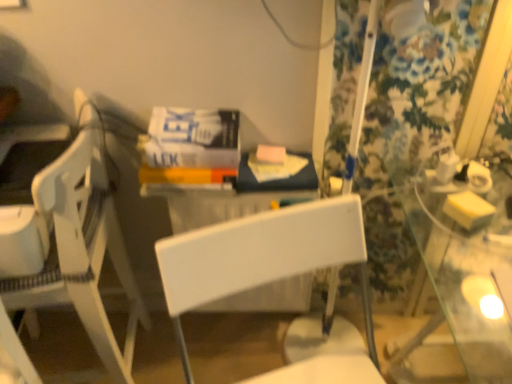
Question: From the image's perspective, is floral fabric curtain at right under white plastic chair at left, the 1th chair from the left?

Choices:
 (A) no
 (B) yes

Answer: (A)

Question: Is floral fabric curtain at right oriented away from white plastic chair at left, the 1th chair from the left?

Choices:
 (A) no
 (B) yes

Answer: (A)

Question: Does floral fabric curtain at right have a larger size compared to white plastic chair at left, the 1th chair from the left?

Choices:
 (A) yes
 (B) no

Answer: (B)

Question: Can you confirm if floral fabric curtain at right is wider than white plastic chair at left, which is the second chair in right-to-left order?

Choices:
 (A) no
 (B) yes

Answer: (A)

Question: Could you tell me if floral fabric curtain at right is facing white plastic chair at left, the 1th chair from the left?

Choices:
 (A) yes
 (B) no

Answer: (B)

Question: Is point (309, 228) closer or farther from the camera than point (439, 91)?

Choices:
 (A) closer
 (B) farther

Answer: (A)

Question: In the image, is white plastic chair at center, placed as the 1th chair when sorted from right to left, positioned in front of or behind floral fabric curtain at right?

Choices:
 (A) front
 (B) behind

Answer: (A)

Question: Considering the positions of white plastic chair at center, the 2th chair viewed from the left, and floral fabric curtain at right in the image, is white plastic chair at center, the 2th chair viewed from the left, bigger or smaller than floral fabric curtain at right?

Choices:
 (A) big
 (B) small

Answer: (A)

Question: In terms of width, does white plastic chair at center, placed as the 1th chair when sorted from right to left, look wider or thinner when compared to floral fabric curtain at right?

Choices:
 (A) thin
 (B) wide

Answer: (B)

Question: Is white plastic chair at left, the 1th chair from the left, to the left or to the right of floral fabric curtain at right in the image?

Choices:
 (A) left
 (B) right

Answer: (A)

Question: Is white plastic chair at left, which is the second chair in right-to-left order, wider or thinner than floral fabric curtain at right?

Choices:
 (A) thin
 (B) wide

Answer: (B)

Question: Is white plastic chair at left, which is the second chair in right-to-left order, bigger or smaller than floral fabric curtain at right?

Choices:
 (A) small
 (B) big

Answer: (B)

Question: From a real-world perspective, is white plastic chair at left, the 1th chair from the left, positioned above or below floral fabric curtain at right?

Choices:
 (A) below
 (B) above

Answer: (A)

Question: Considering the positions of white plastic chair at center, placed as the 1th chair when sorted from right to left, and white plastic chair at left, the 1th chair from the left, in the image, is white plastic chair at center, placed as the 1th chair when sorted from right to left, wider or thinner than white plastic chair at left, the 1th chair from the left,?

Choices:
 (A) wide
 (B) thin

Answer: (A)

Question: Does point (343, 235) appear closer or farther from the camera than point (93, 162)?

Choices:
 (A) farther
 (B) closer

Answer: (B)